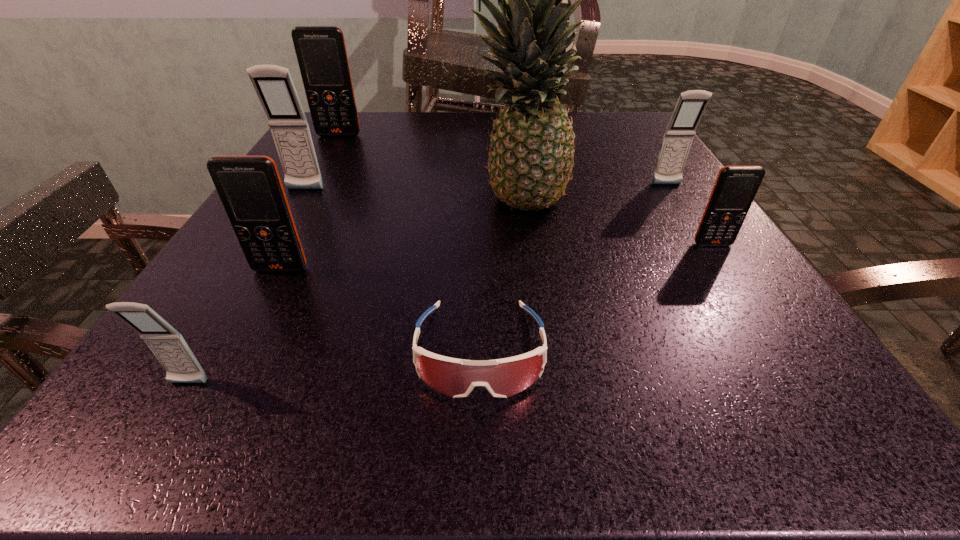
The width and height of the screenshot is (960, 540). In order to click on pineapple in this screenshot , I will do `click(530, 162)`.

Identify the location of green pineapple. (530, 162).

The height and width of the screenshot is (540, 960). I want to click on the third cellular telephone from right to left, so click(x=557, y=0).

Image resolution: width=960 pixels, height=540 pixels. Find the location of `the biggest orange cellular telephone`. the biggest orange cellular telephone is located at coordinates (557, 0).

This screenshot has width=960, height=540. Find the location of `the biggest gray cellular telephone`. the biggest gray cellular telephone is located at coordinates (273, 84).

Locate an element on the screen. This screenshot has width=960, height=540. the second farthest object is located at coordinates (321, 52).

Where is `the third smallest orange cellular telephone`? the third smallest orange cellular telephone is located at coordinates (321, 52).

The height and width of the screenshot is (540, 960). I want to click on the second smallest gray cellular telephone, so click(678, 137).

Locate an element on the screen. The image size is (960, 540). the nearest orange cellular telephone is located at coordinates (250, 188).

The height and width of the screenshot is (540, 960). Identify the location of the second smallest orange cellular telephone. (250, 188).